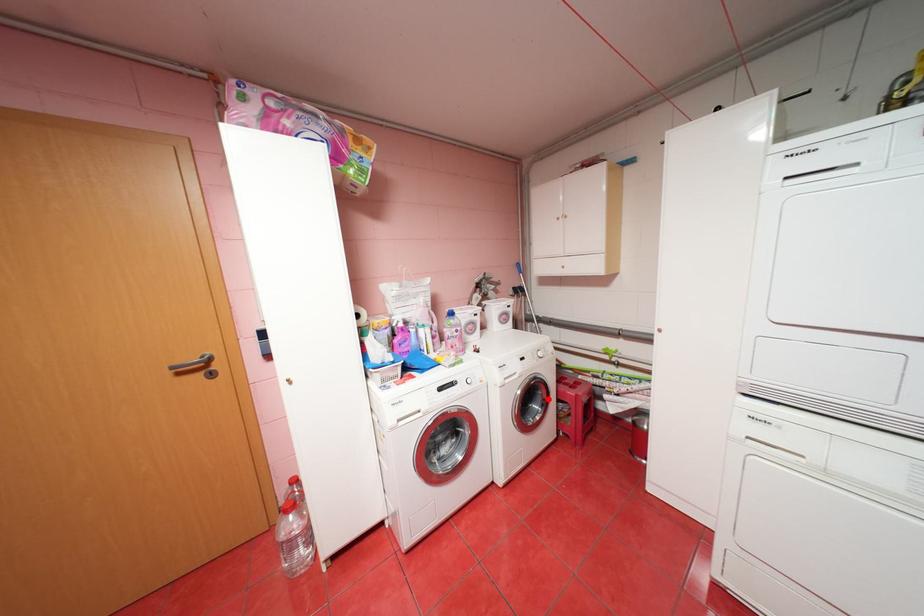
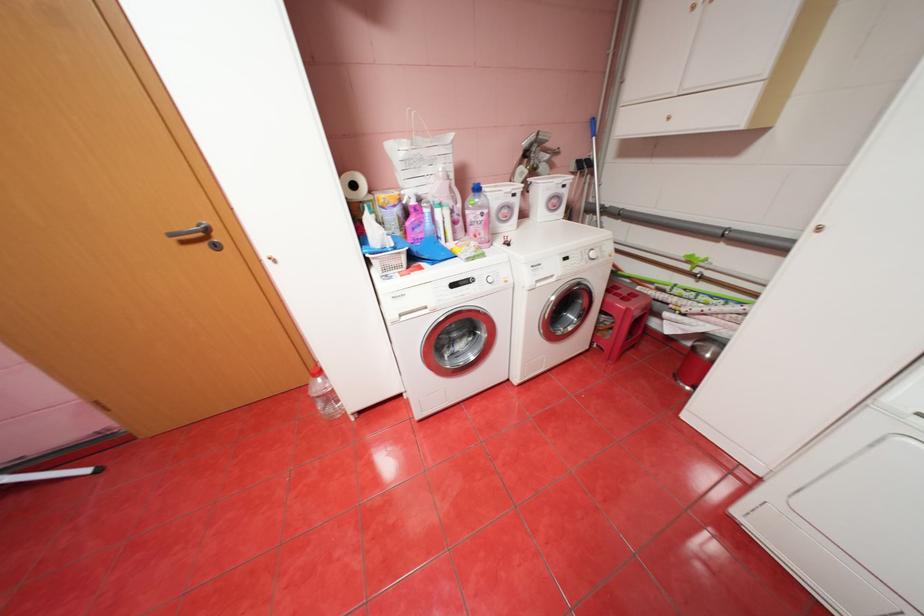
Question: I am providing you with two images of the same scene from different viewpoints. Given a red point in image1, look at the same physical point in image2. Is it:

Choices:
 (A) Closer to the viewpoint
 (B) Farther from the viewpoint

Answer: (A)